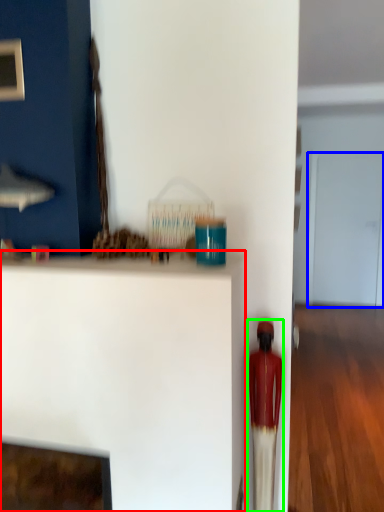
Question: Considering the real-world distances, which object is closest to furniture (highlighted by a red box)? glass door (highlighted by a blue box) or toy (highlighted by a green box).

Choices:
 (A) glass door
 (B) toy

Answer: (B)